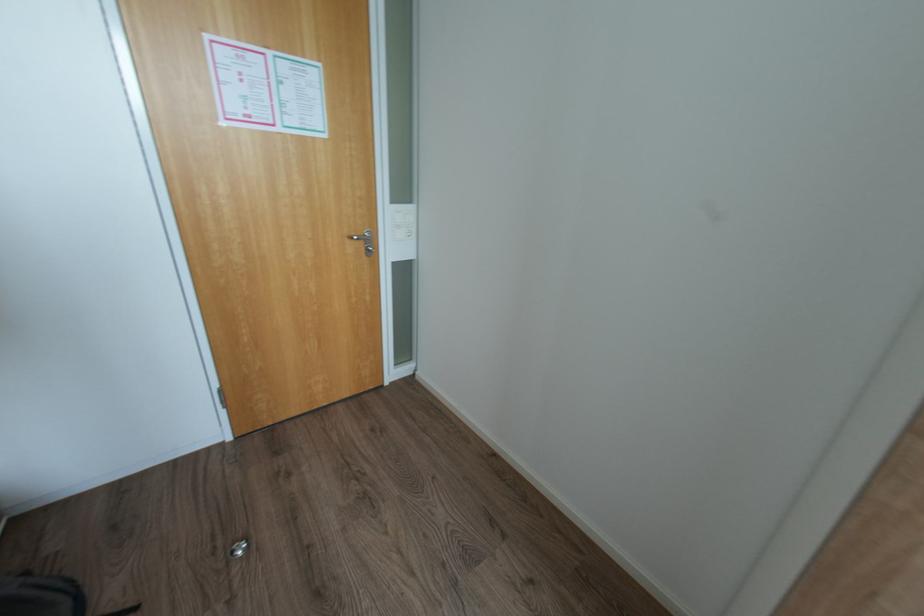
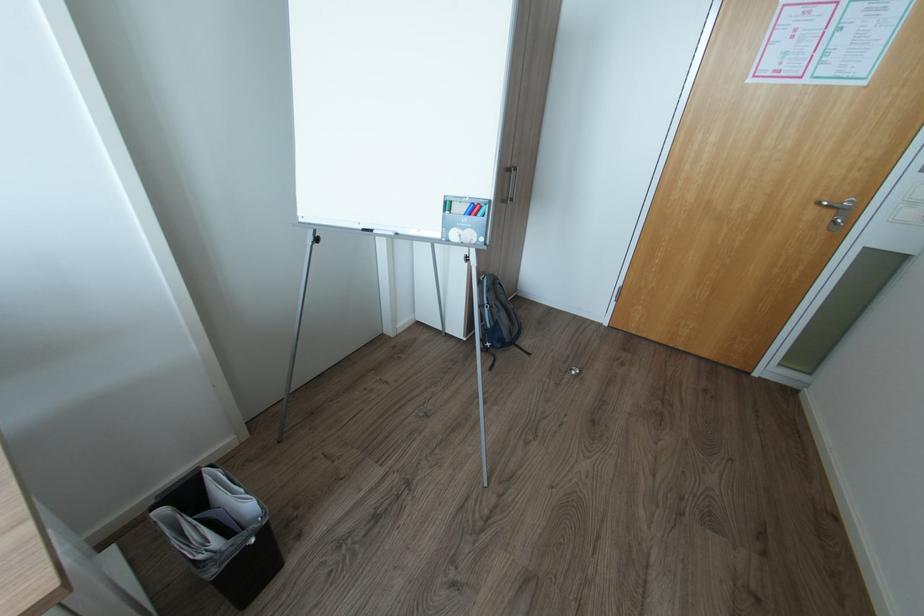
In the second image, find the point that corresponds to [360,237] in the first image.

(830, 204)